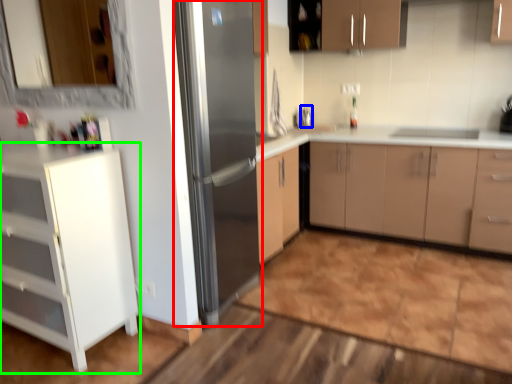
Question: Considering the real-world distances, which object is closest to refrigerator (highlighted by a red box)? faucet (highlighted by a blue box) or cabinetry (highlighted by a green box).

Choices:
 (A) faucet
 (B) cabinetry

Answer: (B)